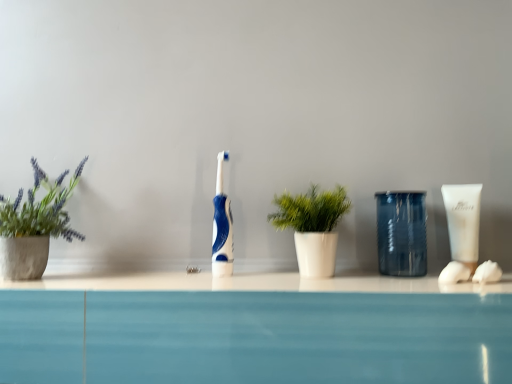
Question: Considering the relative positions of green matte plant at left, the 2th houseplant viewed from the right, and blue glossy toothbrush at center in the image provided, is green matte plant at left, the 2th houseplant viewed from the right, to the left or to the right of blue glossy toothbrush at center?

Choices:
 (A) right
 (B) left

Answer: (B)

Question: Is point (1, 198) positioned closer to the camera than point (217, 256)?

Choices:
 (A) farther
 (B) closer

Answer: (A)

Question: Which is nearer to the white cotton ball at right?

Choices:
 (A) green matte plant at left, which is the 1th houseplant from left to right
 (B) transparent textured glass at center right
 (C) white matte tube at right
 (D) blue glossy toothbrush at center
 (E) white matte plant at center, marked as the first houseplant in a right-to-left arrangement

Answer: (C)

Question: Estimate the real-world distances between objects in this image. Which object is closer to the white matte plant at center, marked as the first houseplant in a right-to-left arrangement?

Choices:
 (A) white cotton ball at right
 (B) transparent textured glass at center right
 (C) white matte tube at right
 (D) blue glossy toothbrush at center
 (E) green matte plant at left, the 2th houseplant viewed from the right

Answer: (B)